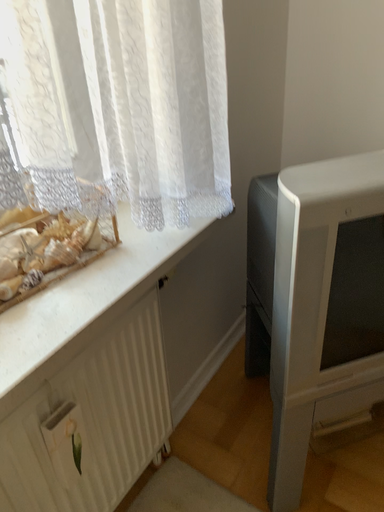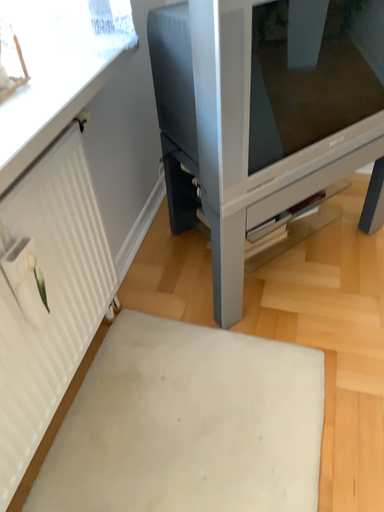
Question: Which way did the camera rotate in the video?

Choices:
 (A) rotated upward
 (B) rotated downward

Answer: (B)